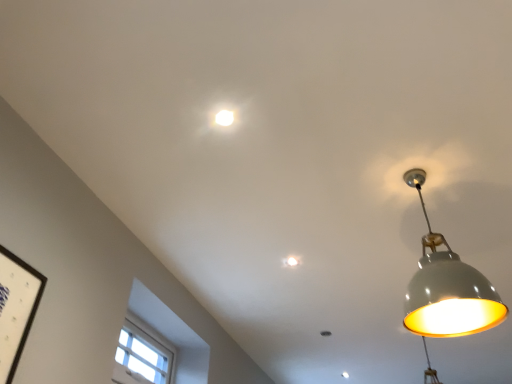
Question: Is white glossy light fixture at upper center, which appears as the 2th lamp when viewed from the right, at the back of matte gray lampshade at right, which ranks as the 1th lamp in right-to-left order?

Choices:
 (A) yes
 (B) no

Answer: (B)

Question: Is matte gray lampshade at right, the second lamp positioned from the left, far away from white glossy light fixture at upper center, the second lamp positioned from the bottom?

Choices:
 (A) yes
 (B) no

Answer: (A)

Question: Does matte gray lampshade at right, positioned as the first lamp in bottom-to-top order, have a lesser width compared to white glossy light fixture at upper center, the second lamp positioned from the bottom?

Choices:
 (A) yes
 (B) no

Answer: (B)

Question: Is matte gray lampshade at right, the first lamp viewed from the front, bigger than white glossy light fixture at upper center, the first lamp viewed from the top?

Choices:
 (A) no
 (B) yes

Answer: (B)

Question: From the image's perspective, is matte gray lampshade at right, positioned as the first lamp in bottom-to-top order, located above white glossy light fixture at upper center, which appears as the 2th lamp when viewed from the right?

Choices:
 (A) no
 (B) yes

Answer: (A)

Question: Is matte gray lampshade at right, which is the 2th lamp from back to front, to the left or to the right of white wooden window at lower left in the image?

Choices:
 (A) right
 (B) left

Answer: (A)

Question: Looking at the image, does matte gray lampshade at right, positioned as the second lamp in top-to-bottom order, seem bigger or smaller compared to white wooden window at lower left?

Choices:
 (A) big
 (B) small

Answer: (A)

Question: Is point (431, 309) positioned closer to the camera than point (130, 357)?

Choices:
 (A) farther
 (B) closer

Answer: (B)

Question: Is matte gray lampshade at right, positioned as the first lamp in bottom-to-top order, wider or thinner than white wooden window at lower left?

Choices:
 (A) wide
 (B) thin

Answer: (A)

Question: From a real-world perspective, is white wooden window at lower left positioned above or below matte gray lampshade at right, which is the 2th lamp from back to front?

Choices:
 (A) above
 (B) below

Answer: (B)

Question: Is white wooden window at lower left in front of or behind matte gray lampshade at right, the second lamp positioned from the left, in the image?

Choices:
 (A) behind
 (B) front

Answer: (A)

Question: Is white wooden window at lower left inside or outside of matte gray lampshade at right, the second lamp positioned from the left?

Choices:
 (A) outside
 (B) inside

Answer: (A)

Question: In terms of size, does white wooden window at lower left appear bigger or smaller than matte gray lampshade at right, the first lamp viewed from the front?

Choices:
 (A) big
 (B) small

Answer: (B)

Question: Is matte gray lampshade at right, the first lamp viewed from the front, to the left or to the right of white glossy light fixture at upper center, which appears as the 2th lamp when viewed from the right, in the image?

Choices:
 (A) right
 (B) left

Answer: (A)

Question: In terms of width, does matte gray lampshade at right, positioned as the second lamp in top-to-bottom order, look wider or thinner when compared to white glossy light fixture at upper center, the first lamp from the back?

Choices:
 (A) thin
 (B) wide

Answer: (B)